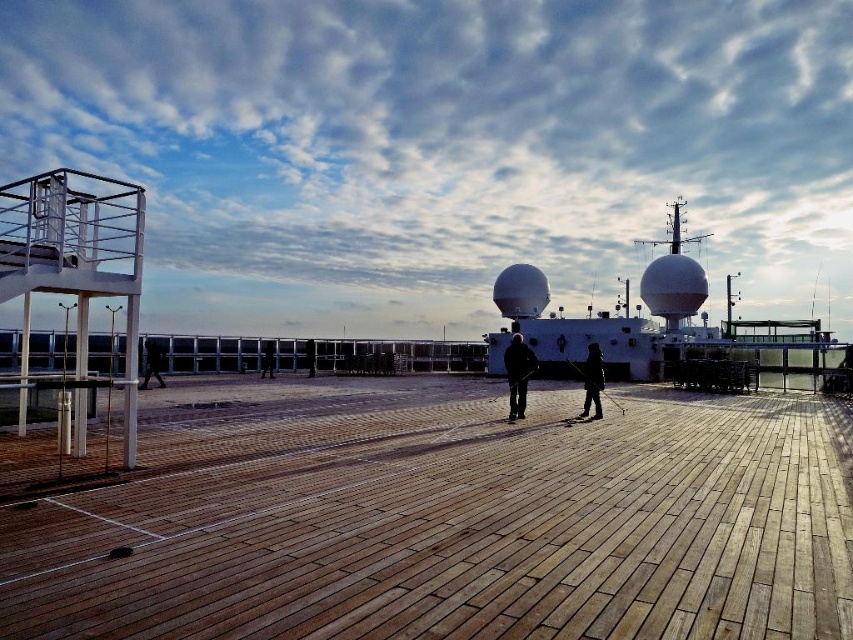
You are a photographer standing on the deck of a ship. You see two people playing shuffleboard wearing the dark gray fabric jacket at center and the dark fabric jacket at center. Which jacket is taller?

The dark gray fabric jacket at center is taller than the dark fabric jacket at center.

You are a shuffleboard player standing at the end of the wooden shuffleboard court. The rules state that players must maintain a minimum distance of 3 meters from the active player to ensure safety. Are you positioned safely if you are standing at the end of the wooden at center?

The players are 3.15 meters apart, which exceeds the required 3 meters minimum distance, so yes, you are positioned safely.

You are a photographer trying to capture a closeup of both the dark gray fabric jacket at center and the dark fabric jacket at center. Since you want both to be in focus, you need to know which one is closer to the camera. Can you determine which jacket is closer?

The dark gray fabric jacket at center has a lesser width compared to dark fabric jacket at center, so it is closer to the camera.